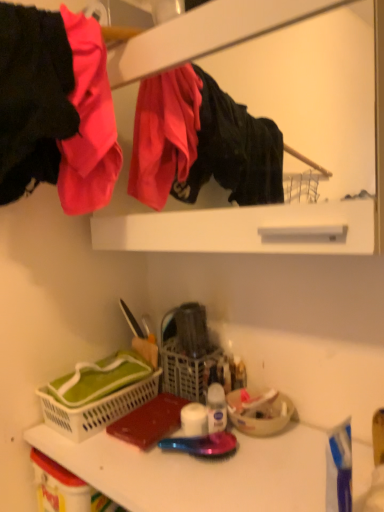
You are a GUI agent. You are given a task and a screenshot of the screen. Output one action in this format:
    pyautogui.click(x=<x>, y=<y>)
    Task: Click on the free location to the left of transparent plastic spray bottle at center
    
    Given the screenshot: What is the action you would take?
    pyautogui.click(x=135, y=456)